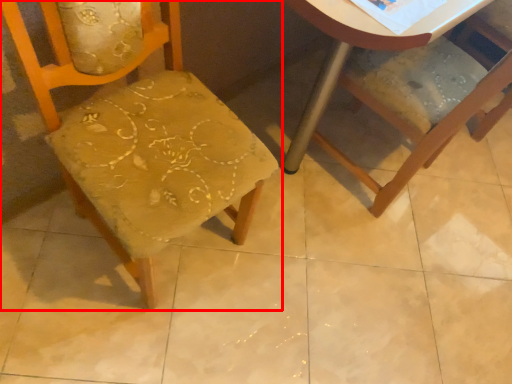
Question: From the image's perspective, what is the correct spatial positioning of chair (annotated by the red box) in reference to chair?

Choices:
 (A) above
 (B) below

Answer: (B)